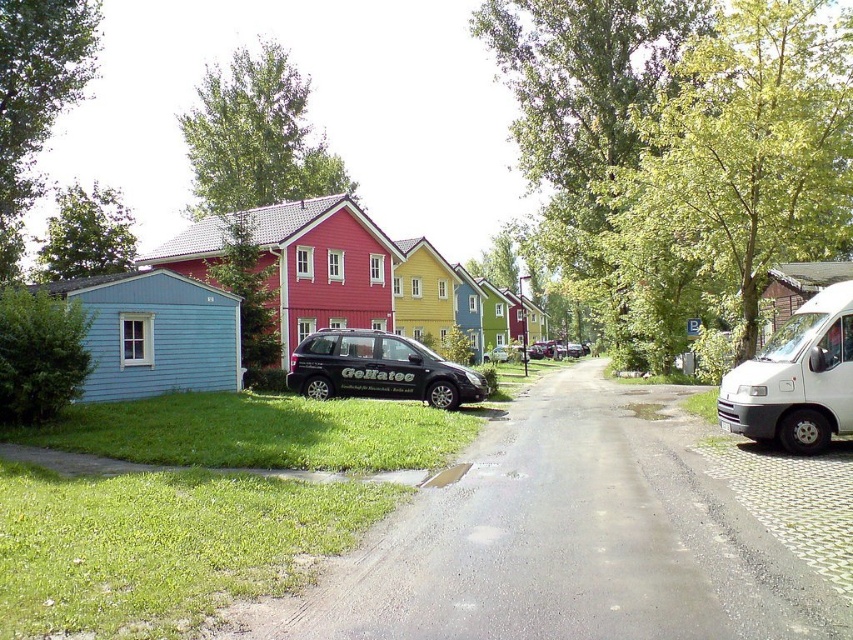
Question: Which point is closer to the camera?

Choices:
 (A) (405, 387)
 (B) (798, 449)

Answer: (B)

Question: Among these points, which one is farthest from the camera?

Choices:
 (A) (326, 385)
 (B) (776, 337)

Answer: (A)

Question: Considering the relative positions of white matte van at right and black matte minivan at center in the image provided, where is white matte van at right located with respect to black matte minivan at center?

Choices:
 (A) above
 (B) below

Answer: (A)

Question: Is white matte van at right to the left of black matte minivan at center from the viewer's perspective?

Choices:
 (A) yes
 (B) no

Answer: (B)

Question: Among these objects, which one is nearest to the camera?

Choices:
 (A) black matte minivan at center
 (B) white matte van at right

Answer: (B)

Question: Is white matte van at right positioned at the back of black matte minivan at center?

Choices:
 (A) no
 (B) yes

Answer: (A)